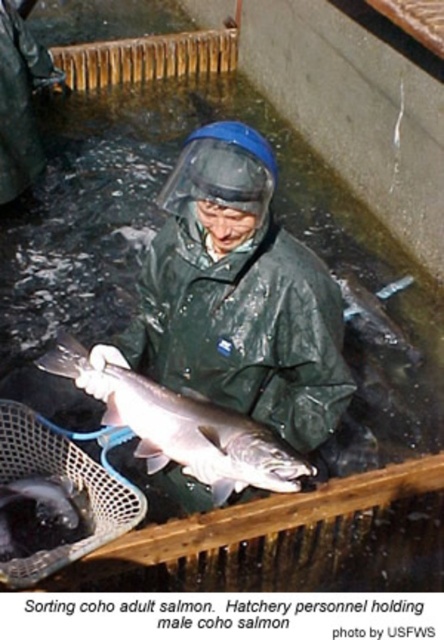
You are a safety inspector checking the hatchery. You notice the green matte jacket at center and the shiny black fish at lower left. Which object is taller?

The green matte jacket at center is taller than the shiny black fish at lower left according to the description.

You are a fishery worker observing the hatchery enclosure. You see a shiny silver fish at center and a shiny black fish at lower left. Which fish is located to the right of the other?

The shiny silver fish at center is positioned on the right side of the shiny black fish at lower left.

You are a fishery worker observing the hatchery enclosure. You notice two fish in the water. Which fish is positioned higher in the water column between the shiny silver fish at center and the shiny black fish at lower left?

The shiny silver fish at center is positioned higher in the water column than the shiny black fish at lower left.